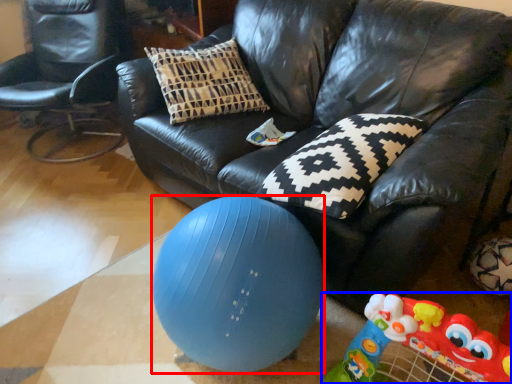
Question: Which point is closer to the camera, ball (highlighted by a red box) or toy (highlighted by a blue box)?

Choices:
 (A) ball
 (B) toy

Answer: (B)